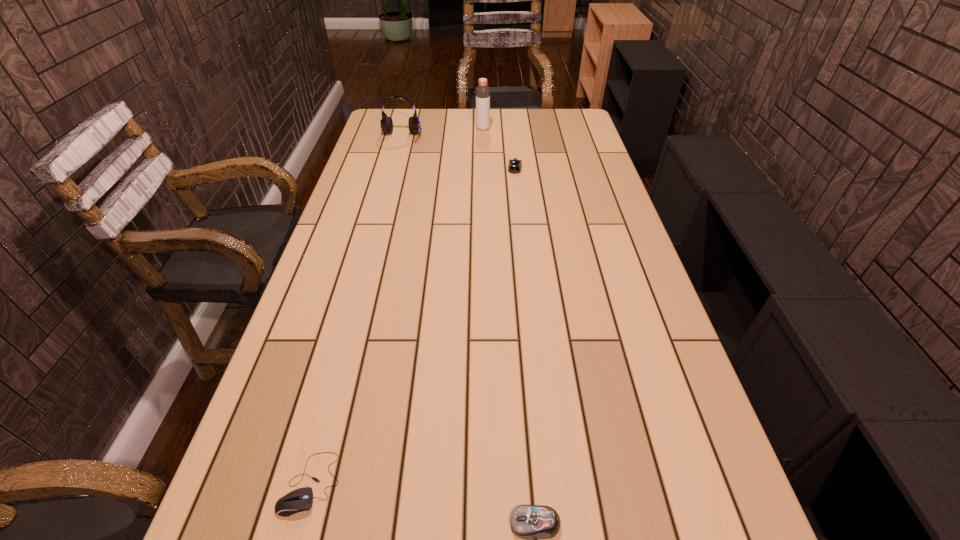
Locate an element on the screen. free space that is in between the third farthest object and the tallest object is located at coordinates (499, 148).

This screenshot has height=540, width=960. Identify the location of vacant space that is in between the shortest computer mouse and the third farthest object. (413, 326).

This screenshot has height=540, width=960. In order to click on vacant space in between the second tallest object and the bottle in this screenshot , I will do `click(442, 133)`.

In order to click on unoccupied position between the third object from left to right and the headset in this screenshot , I will do `click(442, 133)`.

In order to click on free point between the leftmost computer mouse and the headset in this screenshot , I will do `click(356, 310)`.

Locate an element on the screen. the third closest object to the leftmost computer mouse is located at coordinates (386, 122).

Find the location of a particular element. object that is the third closest to the third object from left to right is located at coordinates (299, 500).

Locate which computer mouse ranks in proximity to the headset. Please provide its 2D coordinates. Your answer should be formatted as a tuple, i.e. [(x, y)], where the tuple contains the x and y coordinates of a point satisfying the conditions above.

[(514, 166)]

Identify which computer mouse is the second nearest to the tallest object. Please provide its 2D coordinates. Your answer should be formatted as a tuple, i.e. [(x, y)], where the tuple contains the x and y coordinates of a point satisfying the conditions above.

[(299, 500)]

Image resolution: width=960 pixels, height=540 pixels. I want to click on free space in the image that satisfies the following two spatial constraints: 1. on the back side of the third object from right to left; 2. on the left side of the leftmost computer mouse, so click(x=406, y=129).